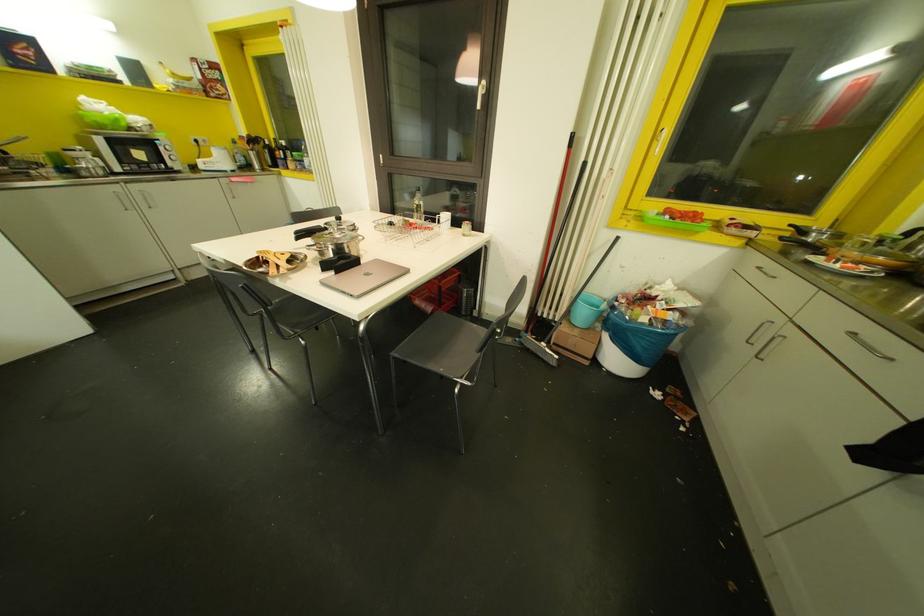
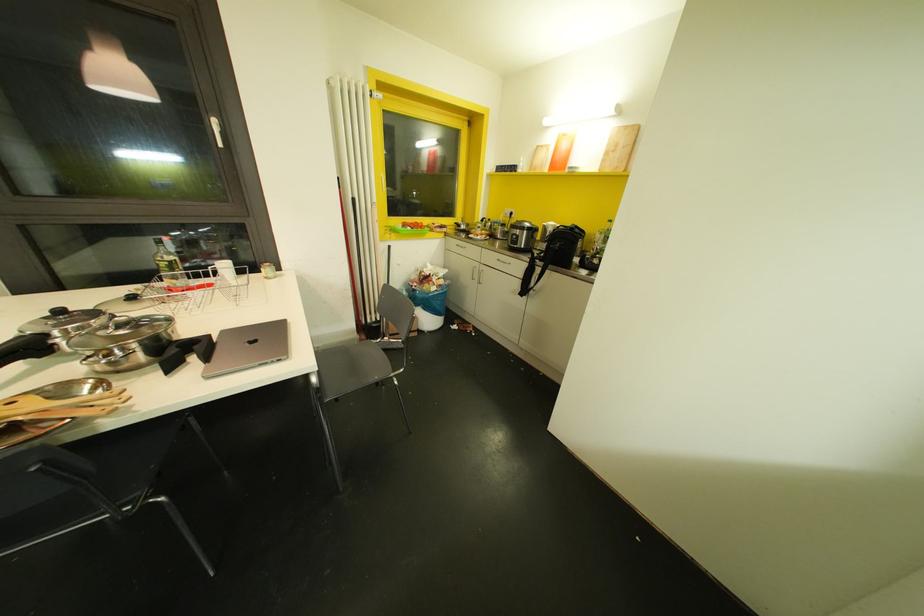
Find the pixel in the second image that matches pixel 617 237 in the first image.

(388, 246)